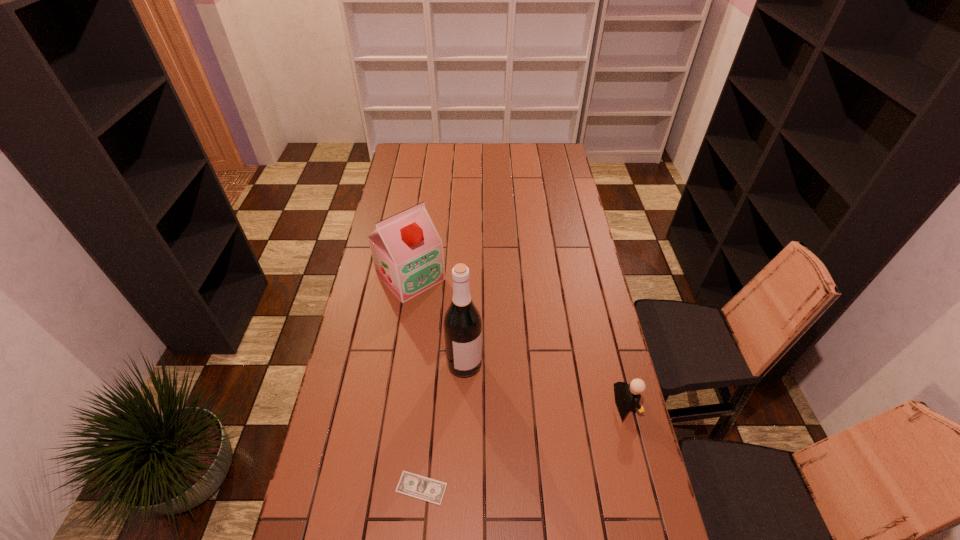
Where is `money`? The image size is (960, 540). money is located at coordinates (410, 484).

Locate an element on the screen. the shortest object is located at coordinates (410, 484).

In order to click on the second shortest object in this screenshot , I will do `click(627, 396)`.

The image size is (960, 540). In order to click on the third farthest object in this screenshot , I will do (x=627, y=396).

Find the location of a particular element. the tallest object is located at coordinates (462, 323).

Where is `wine bottle`? The image size is (960, 540). wine bottle is located at coordinates (462, 323).

Identify the location of the farthest object. The height and width of the screenshot is (540, 960). (407, 251).

Find the location of `soya milk`. soya milk is located at coordinates (407, 251).

Where is `free point located 0.400m on the right of the shortest object`? The height and width of the screenshot is (540, 960). free point located 0.400m on the right of the shortest object is located at coordinates (596, 488).

Where is `blank space located 0.360m on the label of the tallest object`? The image size is (960, 540). blank space located 0.360m on the label of the tallest object is located at coordinates (521, 485).